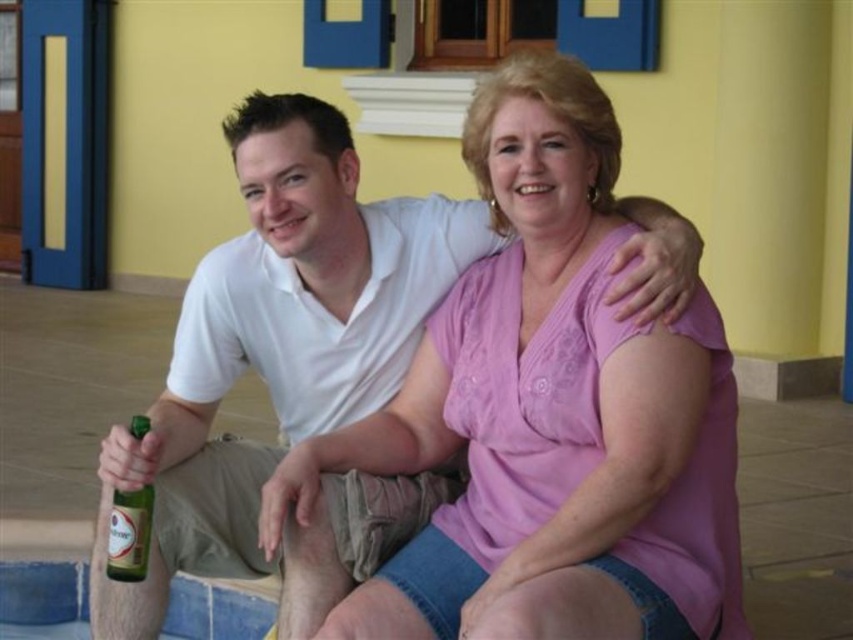
Is pink cotton shirt at center above green glass bottle at lower left?

Indeed, pink cotton shirt at center is positioned over green glass bottle at lower left.

Is point (695, 515) farther from viewer compared to point (148, 561)?

No, (695, 515) is closer to viewer.

Find the location of a particular element. Image resolution: width=853 pixels, height=640 pixels. pink cotton shirt at center is located at coordinates point(550,416).

Identify the location of pink cotton shirt at center. The image size is (853, 640). (550, 416).